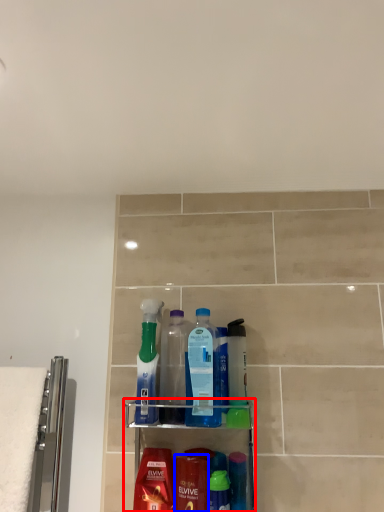
Question: Among these objects, which one is nearest to the camera, shelf (highlighted by a red box) or cleaning product (highlighted by a blue box)?

Choices:
 (A) shelf
 (B) cleaning product

Answer: (A)